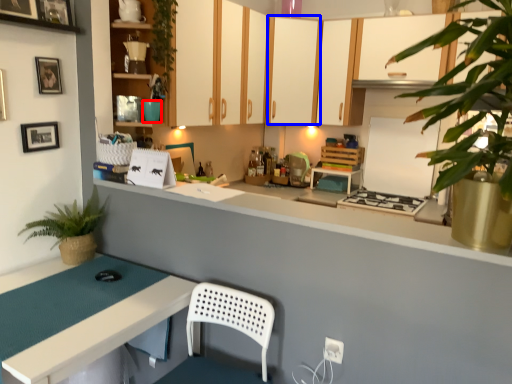
Question: Which object appears farthest to the camera in this image, teal (highlighted by a red box) or cabinetry (highlighted by a blue box)?

Choices:
 (A) teal
 (B) cabinetry

Answer: (B)